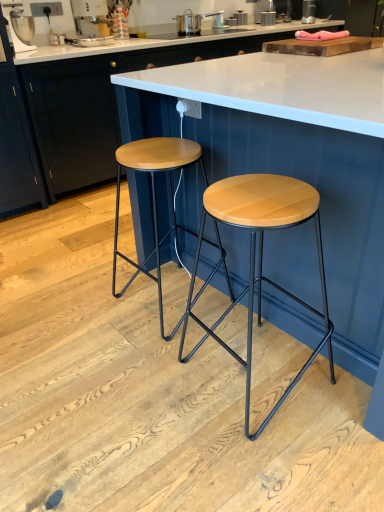
Question: Is metallic silver coffee machine at upper left, acting as the 1th appliance starting from the front, smaller than metallic silver toaster at upper center, arranged as the first appliance when viewed from the right?

Choices:
 (A) yes
 (B) no

Answer: (B)

Question: Is metallic silver coffee machine at upper left, which is the second appliance in top-to-bottom order, located outside metallic silver toaster at upper center, the first appliance positioned from the back?

Choices:
 (A) no
 (B) yes

Answer: (B)

Question: Is metallic silver coffee machine at upper left, acting as the 1th appliance starting from the front, with metallic silver toaster at upper center, which ranks as the 2th appliance in front-to-back order?

Choices:
 (A) yes
 (B) no

Answer: (B)

Question: Does metallic silver coffee machine at upper left, marked as the first appliance in a left-to-right arrangement, have a larger size compared to metallic silver toaster at upper center, the first appliance positioned from the back?

Choices:
 (A) no
 (B) yes

Answer: (B)

Question: Is metallic silver toaster at upper center, the first appliance positioned from the back, completely or partially inside metallic silver coffee machine at upper left, arranged as the 1th appliance when ordered from the bottom?

Choices:
 (A) yes
 (B) no

Answer: (B)

Question: Considering the positions of point (302, 11) and point (231, 263), is point (302, 11) closer or farther from the camera than point (231, 263)?

Choices:
 (A) closer
 (B) farther

Answer: (B)

Question: From a real-world perspective, relative to wooden table at center, is metallic silver toaster at upper center, which ranks as the 2th appliance in front-to-back order, vertically above or below?

Choices:
 (A) above
 (B) below

Answer: (A)

Question: From the image's perspective, is metallic silver toaster at upper center, arranged as the first appliance when viewed from the right, positioned above or below wooden table at center?

Choices:
 (A) below
 (B) above

Answer: (B)

Question: In the image, is metallic silver toaster at upper center, which appears as the 1th appliance when viewed from the top, positioned in front of or behind wooden table at center?

Choices:
 (A) front
 (B) behind

Answer: (B)

Question: From a real-world perspective, relative to metallic silver coffee machine at upper left, which ranks as the 2th appliance in back-to-front order, is wooden stool at center, the second stool viewed from the left, vertically above or below?

Choices:
 (A) below
 (B) above

Answer: (A)

Question: Considering the relative positions of wooden stool at center, the second stool viewed from the left, and metallic silver coffee machine at upper left, which is the 2th appliance in right-to-left order, in the image provided, is wooden stool at center, the second stool viewed from the left, to the left or to the right of metallic silver coffee machine at upper left, which is the 2th appliance in right-to-left order,?

Choices:
 (A) right
 (B) left

Answer: (A)

Question: Considering the positions of point (246, 408) and point (72, 9), is point (246, 408) closer or farther from the camera than point (72, 9)?

Choices:
 (A) closer
 (B) farther

Answer: (A)

Question: From the image's perspective, relative to metallic silver coffee machine at upper left, which is the second appliance in top-to-bottom order, is wooden stool at center, the second stool viewed from the left, above or below?

Choices:
 (A) below
 (B) above

Answer: (A)

Question: From the image's perspective, is wooden seat stool at center, marked as the second stool in a right-to-left arrangement, positioned above or below metallic silver toaster at upper center, the first appliance positioned from the back?

Choices:
 (A) below
 (B) above

Answer: (A)

Question: In the image, is wooden seat stool at center, marked as the second stool in a right-to-left arrangement, positioned in front of or behind metallic silver toaster at upper center, the first appliance positioned from the back?

Choices:
 (A) front
 (B) behind

Answer: (A)